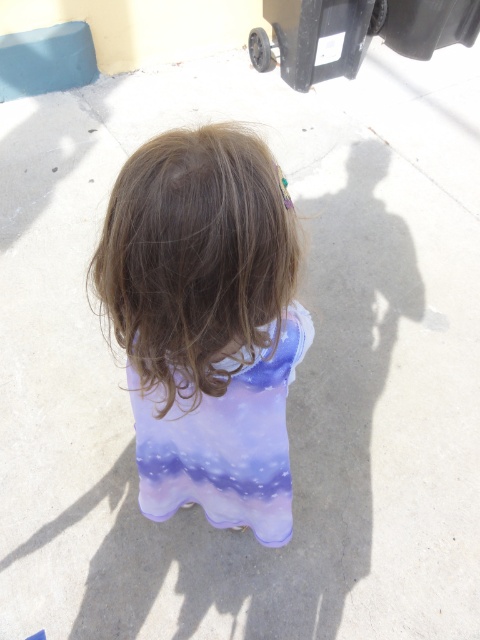
You are a photographer trying to capture the child from behind. The point at coordinates (x=196, y=260) is part of the brown smooth hair at center. If you want to focus on the sleeveless dress with gradient design, where should you adjust your camera? Up, down, left, or right?

The point at coordinates (x=196, y=260) is on the brown smooth hair at center, so to focus on the sleeveless dress with gradient design, you should adjust the camera downward from the current position.

You are a photographer trying to capture the child from behind. The scene has the brown smooth hair at center and the purple fabric dress at center. Which object is closer to the camera?

The brown smooth hair at center is closer to the camera because it is in front of the purple fabric dress at center.

You are standing at the point labeled point (115, 232) and want to walk towards the point labeled point (237, 483). Which direction should you face to move directly towards your destination?

Since point (115, 232) is in front of point (237, 483), you should face backwards to move directly towards point (237, 483).